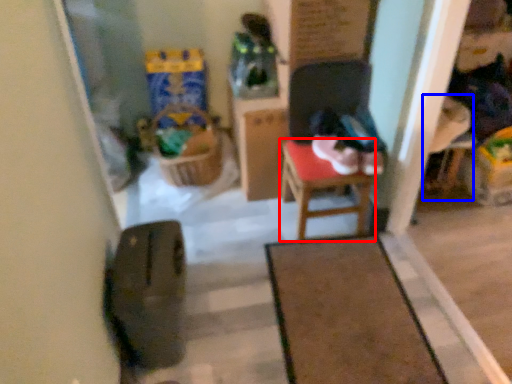
Question: Among these objects, which one is farthest to the camera, table (highlighted by a red box) or armchair (highlighted by a blue box)?

Choices:
 (A) table
 (B) armchair

Answer: (B)